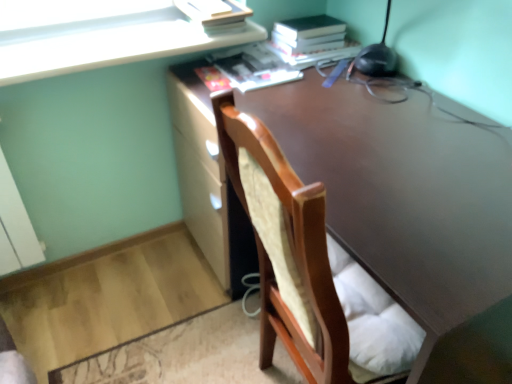
This screenshot has height=384, width=512. Find the location of `vacant space in front of matte paper book at upper center`. vacant space in front of matte paper book at upper center is located at coordinates (274, 104).